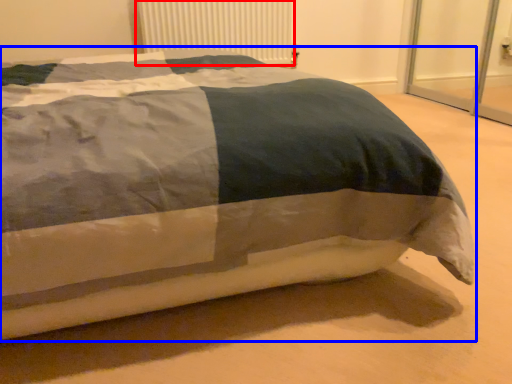
Question: Which object is further to the camera taking this photo, radiator (highlighted by a red box) or bed (highlighted by a blue box)?

Choices:
 (A) radiator
 (B) bed

Answer: (A)